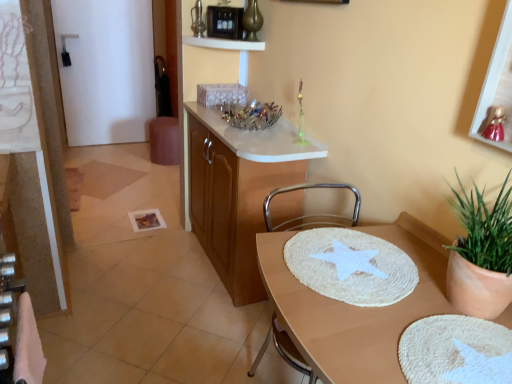
Locate an element on the screen. The width and height of the screenshot is (512, 384). blank space above beige woven placemat at center (from a real-world perspective) is located at coordinates (362, 289).